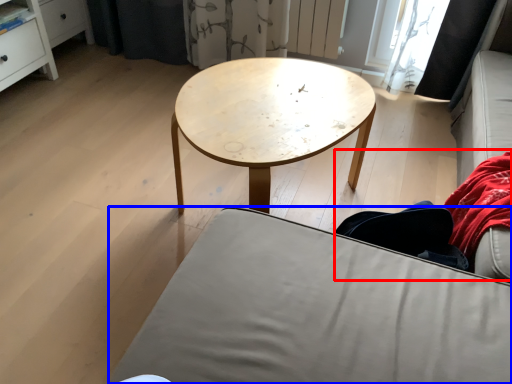
Question: Among these objects, which one is farthest to the camera, couple (highlighted by a red box) or studio couch (highlighted by a blue box)?

Choices:
 (A) couple
 (B) studio couch

Answer: (A)